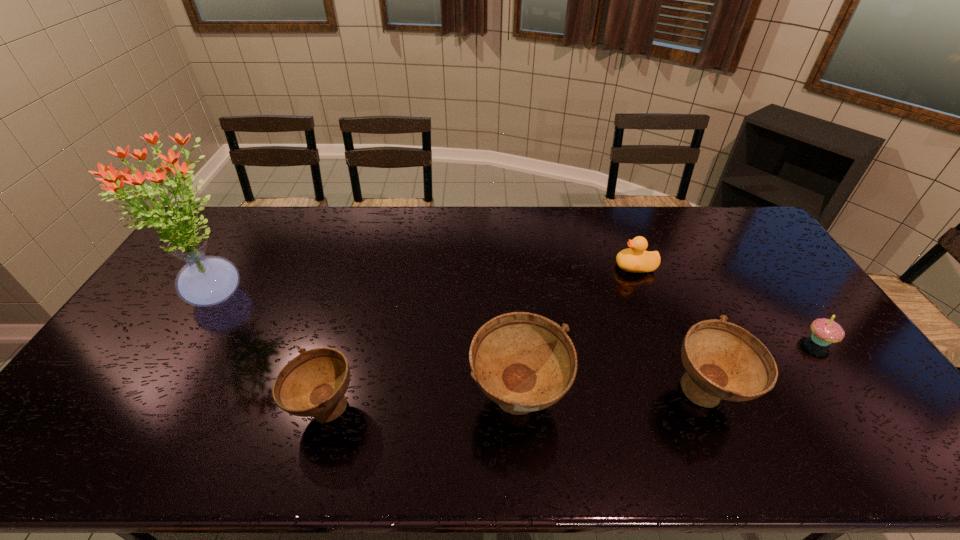
Locate an element on the screen. vacant space positioned 0.400m on the right of the second soup bowl from left to right is located at coordinates (725, 402).

The width and height of the screenshot is (960, 540). In order to click on vacant region located 0.340m on the right of the second tallest soup bowl in this screenshot , I will do `click(880, 394)`.

You are a GUI agent. You are given a task and a screenshot of the screen. Output one action in this format:
    pyautogui.click(x=<x>, y=<y>)
    Task: Click on the free space located 0.340m on the face of the duck
    This screenshot has height=540, width=960.
    Given the screenshot: What is the action you would take?
    pyautogui.click(x=515, y=267)

You are a GUI agent. You are given a task and a screenshot of the screen. Output one action in this format:
    pyautogui.click(x=<x>, y=<y>)
    Task: Click on the vacant space located on the face of the duck
    
    Given the screenshot: What is the action you would take?
    pyautogui.click(x=574, y=267)

The height and width of the screenshot is (540, 960). Find the location of `vacant area situated on the face of the duck`. vacant area situated on the face of the duck is located at coordinates (500, 267).

At what (x,y) coordinates should I click in order to perform the action: click on vacant area situated on the front of the cupcake. Please return your answer as a coordinate pair (x, y). Looking at the image, I should click on (872, 413).

Identify the location of free space located 0.280m on the right of the leftmost object. This screenshot has width=960, height=540. (351, 297).

The height and width of the screenshot is (540, 960). I want to click on object that is at the left edge, so pos(204,281).

Find the location of a particular element. This screenshot has width=960, height=540. object positioned at the right edge is located at coordinates (824, 331).

At what (x,y) coordinates should I click in order to perform the action: click on free space at the far edge of the desktop. Please return your answer as a coordinate pair (x, y). The image size is (960, 540). Looking at the image, I should click on (309, 206).